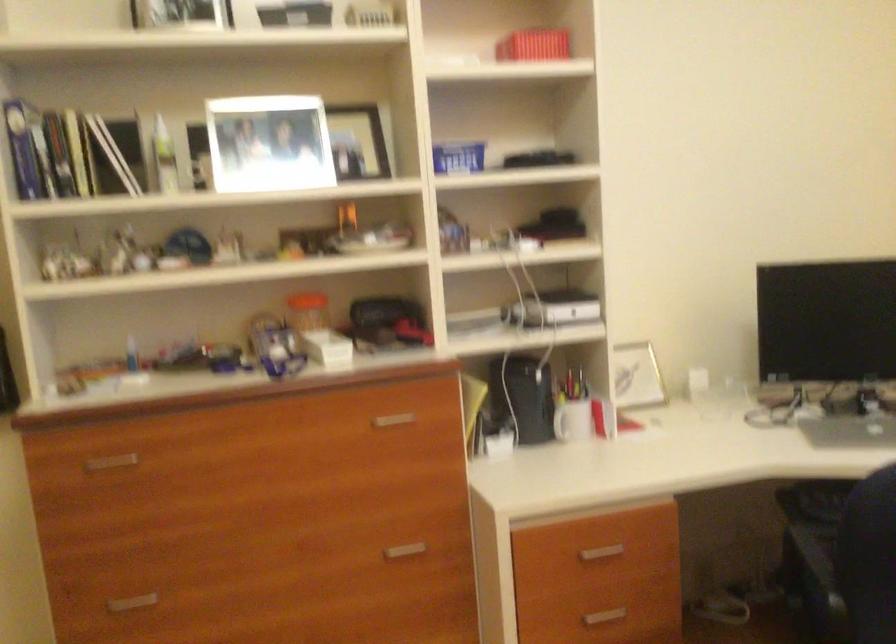
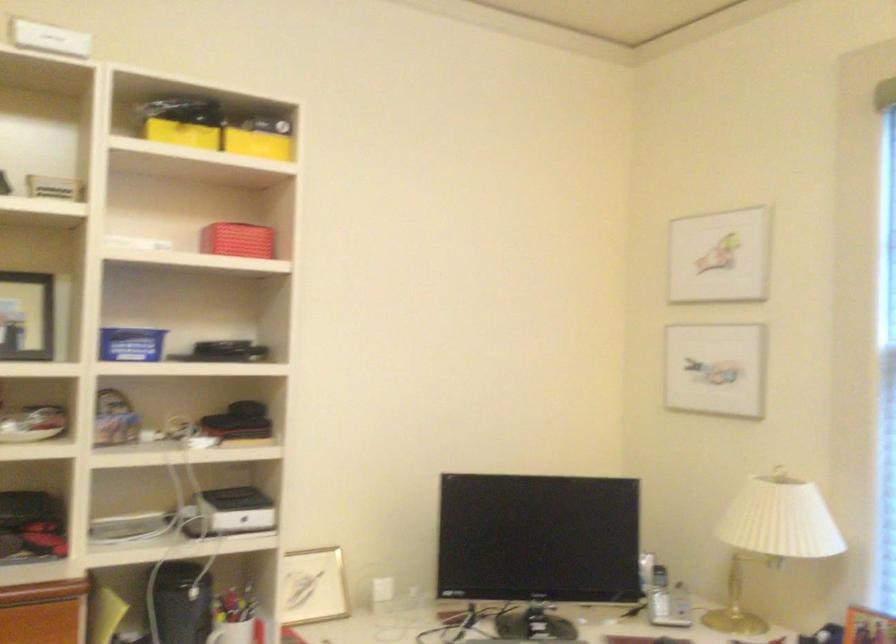
Question: The first image is from the beginning of the video and the second image is from the end. How did the camera likely rotate when shooting the video?

Choices:
 (A) Left
 (B) Right
 (C) Up
 (D) Down

Answer: (B)